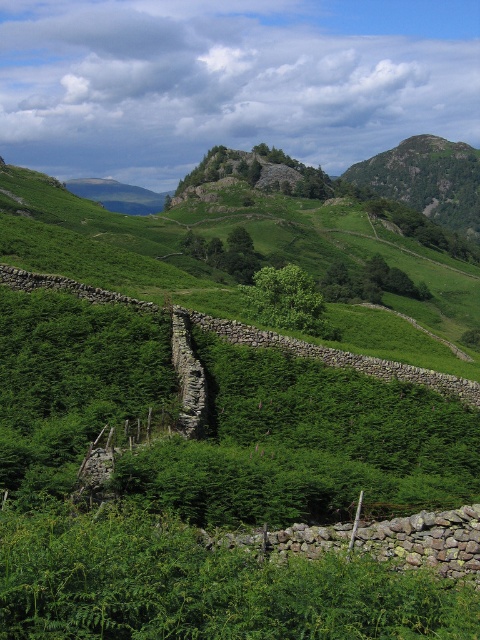
Question: Which point is closer to the camera?

Choices:
 (A) (79, 196)
 (B) (444, 140)

Answer: (A)

Question: Does green grassy hillside at center have a larger size compared to rugged rock mountain at upper center?

Choices:
 (A) yes
 (B) no

Answer: (B)

Question: Is green grassy hillside at center positioned behind rugged rock mountain at upper center?

Choices:
 (A) no
 (B) yes

Answer: (A)

Question: Considering the relative positions of green grassy hillside at center and rugged rock mountain at upper center in the image provided, where is green grassy hillside at center located with respect to rugged rock mountain at upper center?

Choices:
 (A) right
 (B) left

Answer: (B)